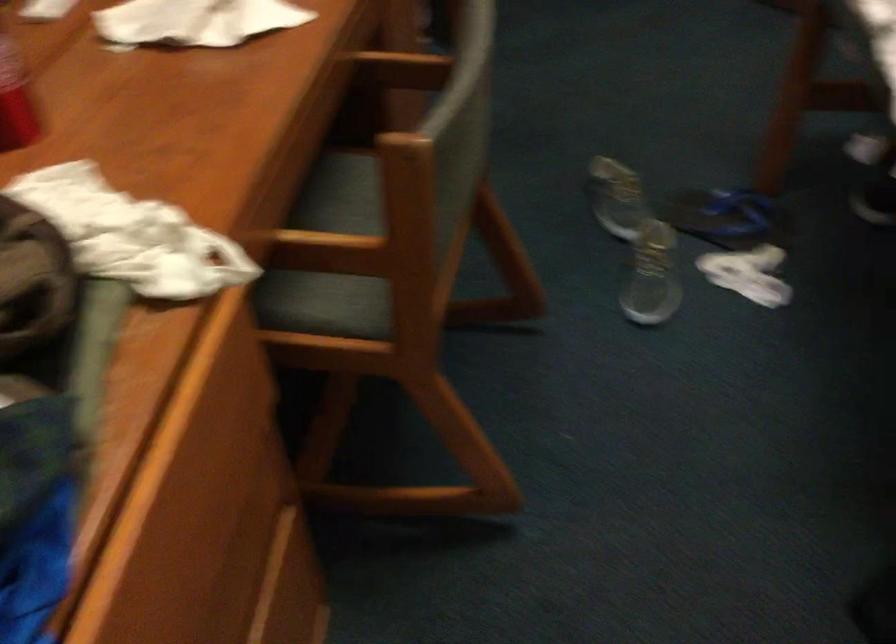
Find where to sit the chair sitting surface. Please return your answer as a coordinate pair (x, y).

(339, 250)